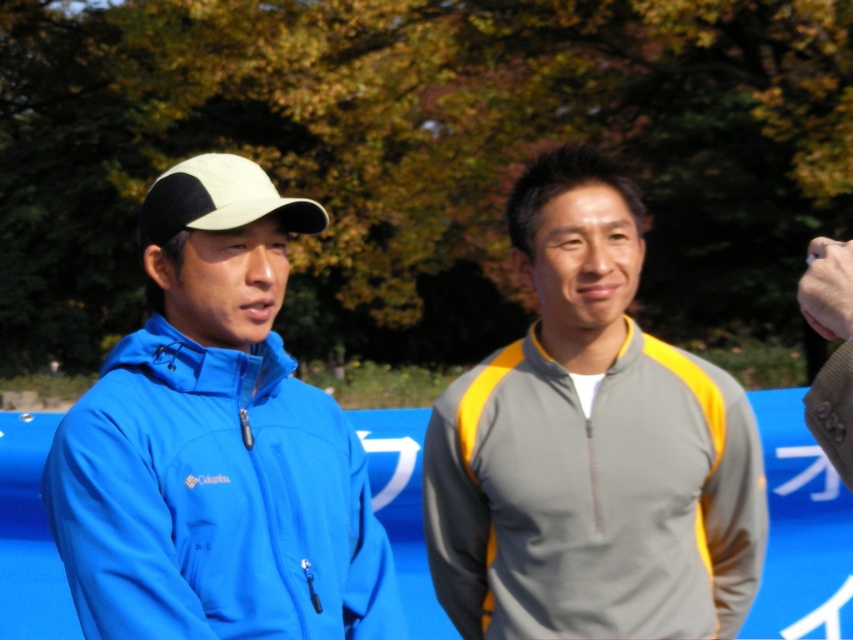
Can you confirm if blue fleece jacket at left is thinner than gray/yellow zip-up jacket at center?

Yes, blue fleece jacket at left is thinner than gray/yellow zip-up jacket at center.

Does point (201, 289) come in front of point (659, 532)?

Yes.

This screenshot has height=640, width=853. Describe the element at coordinates (215, 444) in the screenshot. I see `blue fleece jacket at left` at that location.

Where is `blue fleece jacket at left`? blue fleece jacket at left is located at coordinates (215, 444).

Is blue fleece jacket at left shorter than white matte baseball cap at center?

No, blue fleece jacket at left is not shorter than white matte baseball cap at center.

Does point (134, 417) come behind point (201, 170)?

No, (134, 417) is closer to viewer.

Which is behind, point (78, 496) or point (318, 211)?

The point (318, 211) is more distant.

The image size is (853, 640). I want to click on blue fleece jacket at left, so click(x=215, y=444).

Does gray/yellow zip-up jacket at center lie in front of white matte baseball cap at center?

No, gray/yellow zip-up jacket at center is behind white matte baseball cap at center.

Is gray/yellow zip-up jacket at center bigger than white matte baseball cap at center?

Yes, gray/yellow zip-up jacket at center is bigger than white matte baseball cap at center.

What do you see at coordinates (590, 448) in the screenshot? This screenshot has height=640, width=853. I see `gray/yellow zip-up jacket at center` at bounding box center [590, 448].

The image size is (853, 640). I want to click on gray/yellow zip-up jacket at center, so click(590, 448).